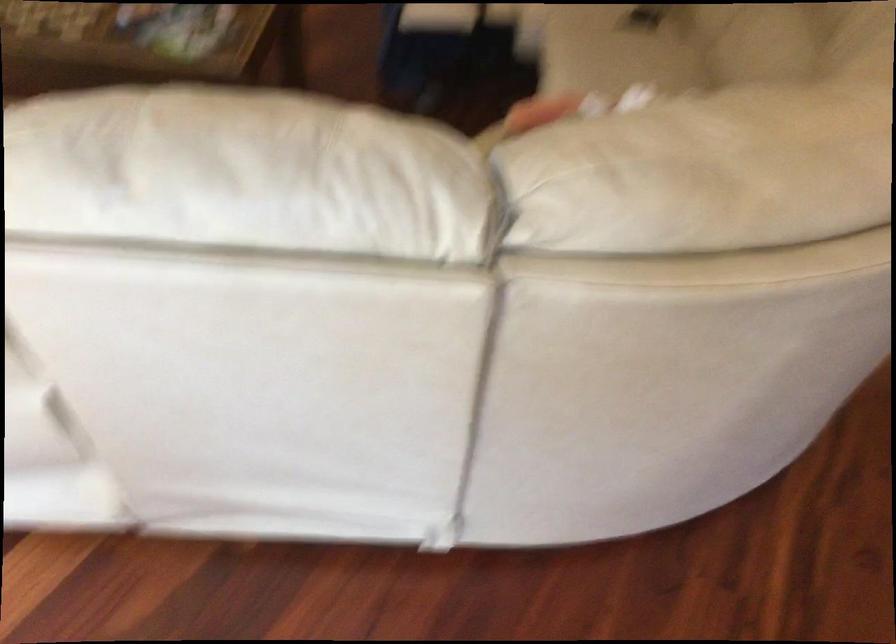
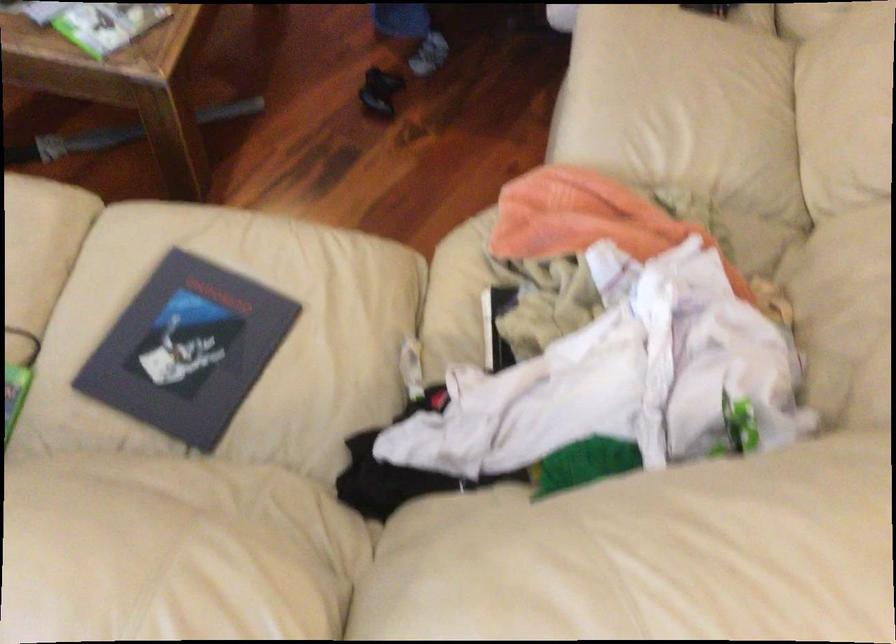
Question: Which direction would the cameraman need to move to produce the second image? Reply with the corresponding letter.

Choices:
 (A) Left
 (B) Right
 (C) Forward
 (D) Backward

Answer: (C)